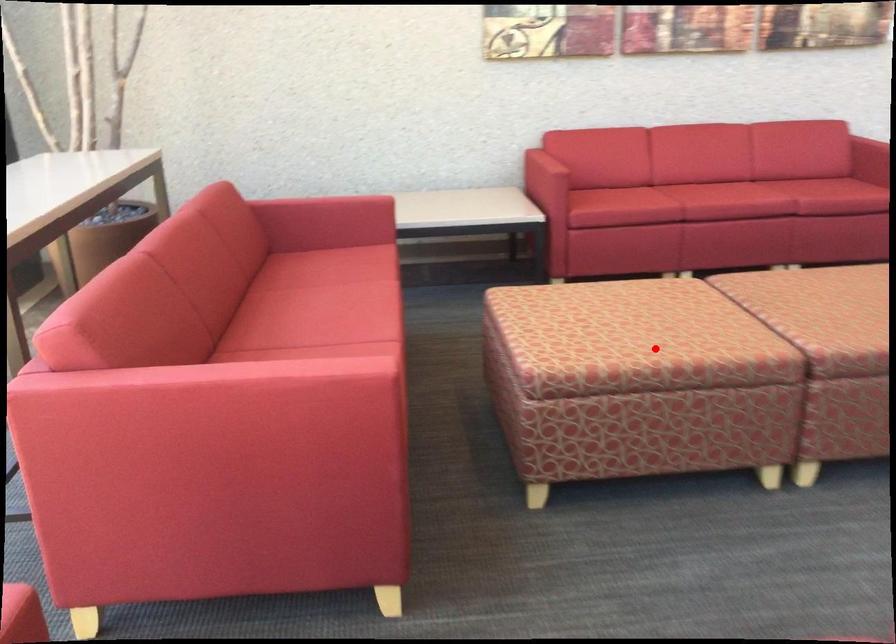
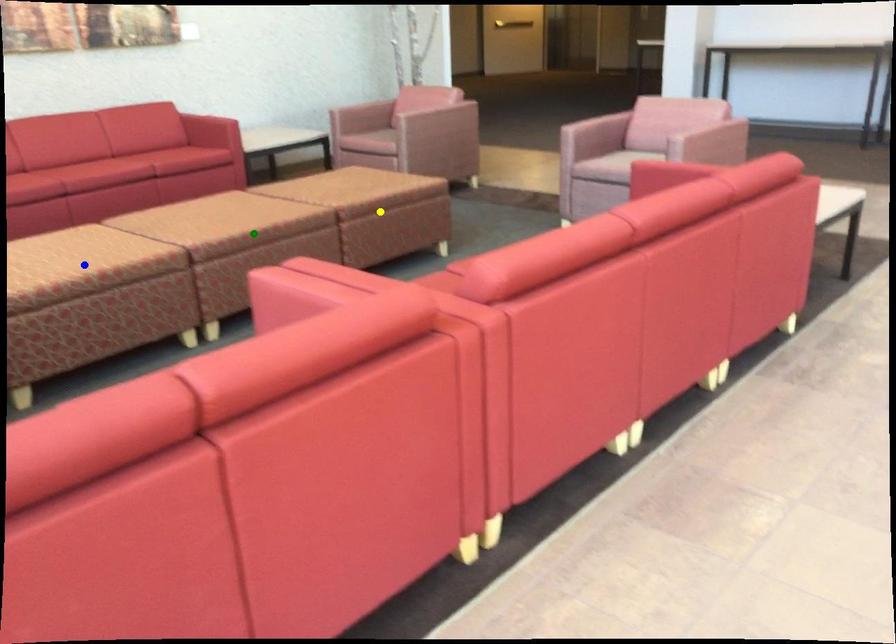
Question: I am providing you with two images of the same scene from different viewpoints. A red point is marked on the first image. You are given multiple points on the second image. In image 2, which mark is for the same physical point as the one in image 1?

Choices:
 (A) green point
 (B) blue point
 (C) yellow point

Answer: (B)